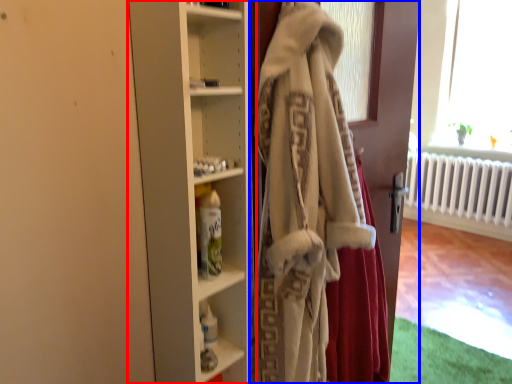
Question: Which object appears farthest to the camera in this image, cupboard (highlighted by a red box) or door (highlighted by a blue box)?

Choices:
 (A) cupboard
 (B) door

Answer: (A)